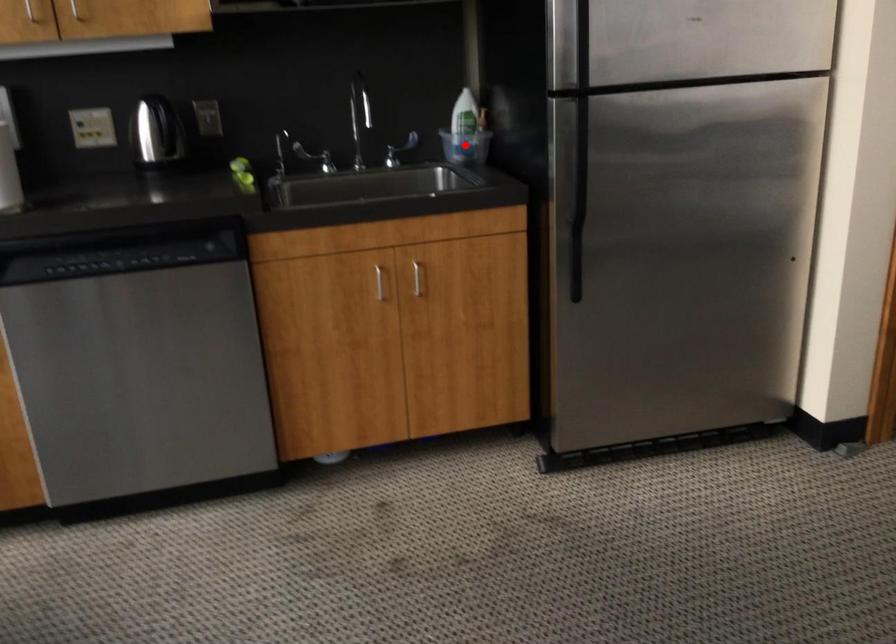
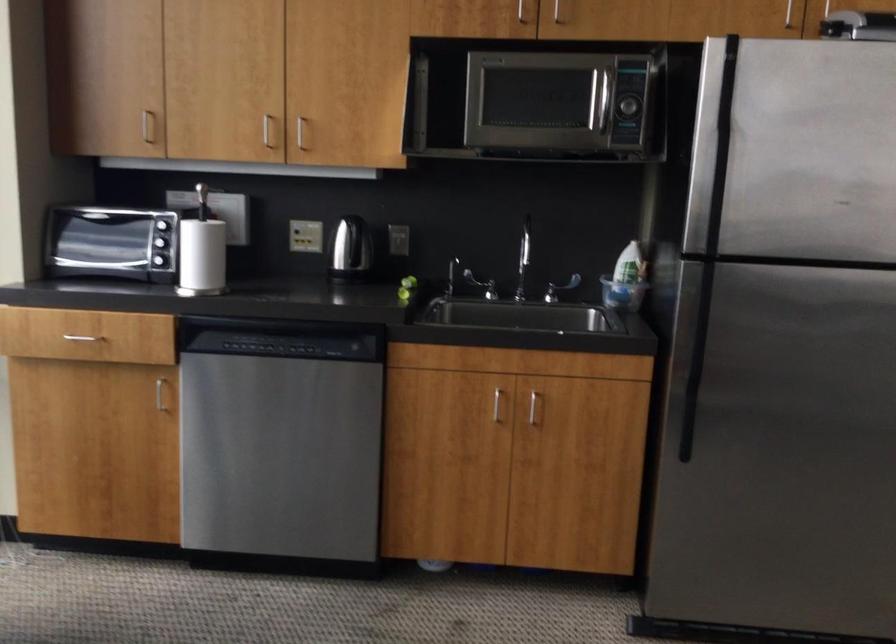
Question: I am providing you with two images of the same scene from different viewpoints. A red point is marked on the first image. Can you still see the location of the red point in image 2?

Choices:
 (A) Yes
 (B) No

Answer: (A)